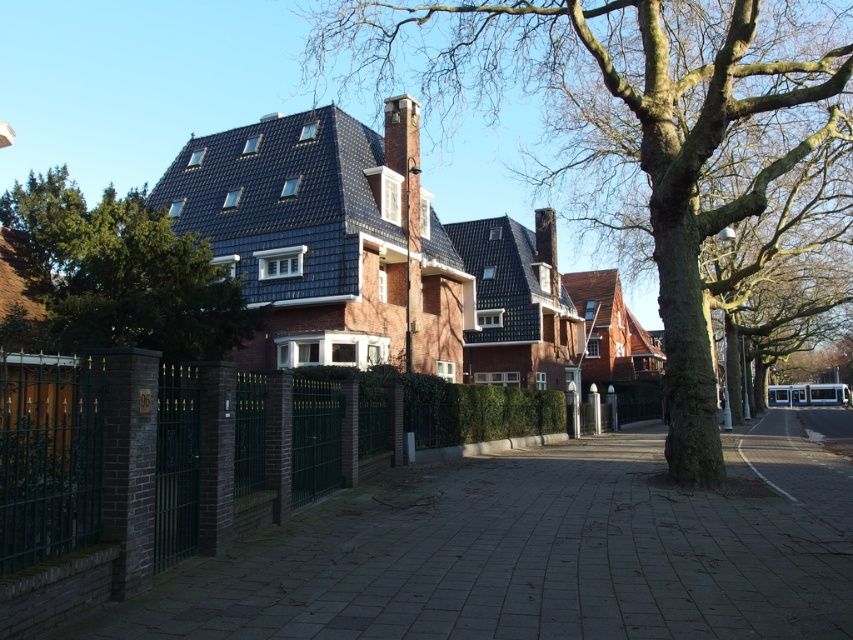
Image resolution: width=853 pixels, height=640 pixels. What do you see at coordinates (538, 552) in the screenshot?
I see `gray concrete pavement at lower left` at bounding box center [538, 552].

Does gray concrete pavement at lower left appear under smooth bark tree at center?

Yes, gray concrete pavement at lower left is below smooth bark tree at center.

Is point (312, 564) positioned before point (531, 68)?

Yes, point (312, 564) is closer to viewer.

This screenshot has width=853, height=640. I want to click on gray concrete pavement at lower left, so click(538, 552).

Measure the distance between smooth bark tree at center and camera.

smooth bark tree at center is 12.08 meters away from camera.

Who is taller, smooth bark tree at center or green leafy tree at upper left?

With more height is smooth bark tree at center.

Find the location of `smooth bark tree at center`. smooth bark tree at center is located at coordinates (635, 125).

Is gray concrete pavement at lower left thinner than green leafy tree at upper left?

Yes.

Between gray concrete pavement at lower left and green leafy tree at upper left, which one is positioned lower?

gray concrete pavement at lower left is lower down.

Which is behind, point (788, 422) or point (62, 264)?

Point (788, 422)

The width and height of the screenshot is (853, 640). Identify the location of gray concrete pavement at lower left. (538, 552).